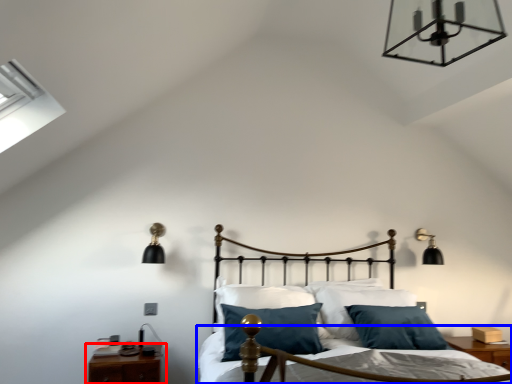
Question: Which object is closer to the camera taking this photo, nightstand (highlighted by a red box) or bed frame (highlighted by a blue box)?

Choices:
 (A) nightstand
 (B) bed frame

Answer: (B)